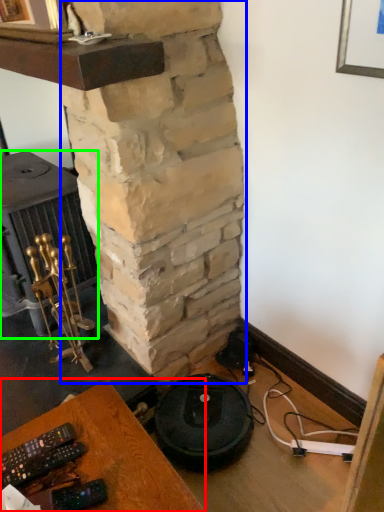
Question: Which is nearer to the furniture (highlighted by a red box)? pillar (highlighted by a blue box) or stove (highlighted by a green box).

Choices:
 (A) pillar
 (B) stove

Answer: (A)